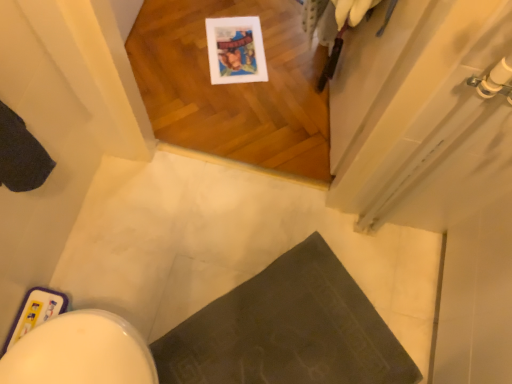
Describe the element at coordinates (287, 330) in the screenshot. I see `black textured mat at lower center` at that location.

Identify the location of black textured mat at lower center. (287, 330).

At what (x,y) coordinates should I click in order to perform the action: click on black textured mat at lower center. Please return your answer as a coordinate pair (x, y). This screenshot has width=512, height=384. Looking at the image, I should click on (287, 330).